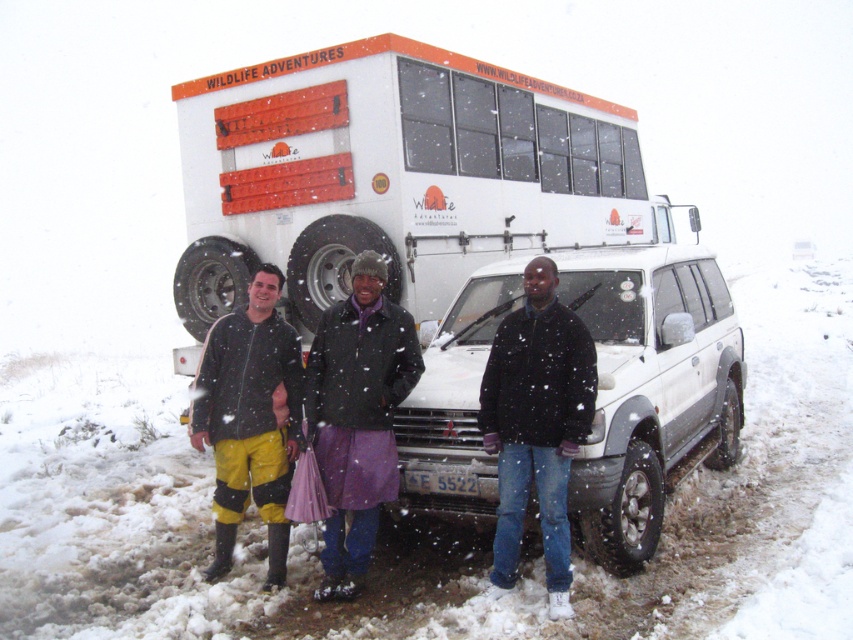
Who is positioned more to the left, white matte bus at center or yellow rubber boots at lower left?

yellow rubber boots at lower left

Describe the element at coordinates (392, 173) in the screenshot. I see `white matte bus at center` at that location.

Find the location of `white matte bus at center`. white matte bus at center is located at coordinates (392, 173).

Can you confirm if white matte suv at center is positioned above yellow rubber boots at lower left?

Yes.

Who is positioned more to the left, white matte suv at center or yellow rubber boots at lower left?

yellow rubber boots at lower left is more to the left.

Who is more distant from viewer, [711,433] or [206,401]?

Point [711,433]

Where is `white matte suv at center`? The height and width of the screenshot is (640, 853). white matte suv at center is located at coordinates (648, 387).

Is black matte jacket at center smaller than yellow rubber pants at lower left?

Yes, black matte jacket at center is smaller than yellow rubber pants at lower left.

This screenshot has height=640, width=853. Describe the element at coordinates (537, 424) in the screenshot. I see `black matte jacket at center` at that location.

Which is in front, point (579, 401) or point (281, 324)?

Point (579, 401) is more forward.

The height and width of the screenshot is (640, 853). I want to click on black matte jacket at center, so click(x=537, y=424).